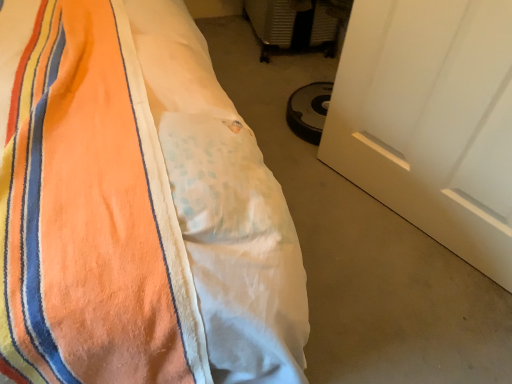
What do you see at coordinates (136, 208) in the screenshot?
I see `orange fleece blanket at left` at bounding box center [136, 208].

Image resolution: width=512 pixels, height=384 pixels. Find the location of `white fabric at lower left`. white fabric at lower left is located at coordinates (362, 248).

The width and height of the screenshot is (512, 384). Describe the element at coordinates (431, 120) in the screenshot. I see `white matte door at lower right` at that location.

At what (x,y) coordinates should I click in order to perform the action: click on orange fleece blanket at left. Please return your answer as a coordinate pair (x, y). This screenshot has width=512, height=384. Looking at the image, I should click on (136, 208).

Looking at this image, is orange fleece blanket at left facing away from white fabric at lower left?

No, orange fleece blanket at left is not facing away from white fabric at lower left.

Image resolution: width=512 pixels, height=384 pixels. I want to click on concrete located on the right of orange fleece blanket at left, so click(x=362, y=248).

Does orange fleece blanket at left come behind white fabric at lower left?

That is False.

How far apart are orange fleece blanket at left and white fabric at lower left?

orange fleece blanket at left is 29.56 inches from white fabric at lower left.

Where is `concrete directly beneath the white matte door at lower right (from a real-world perspective)`? The image size is (512, 384). concrete directly beneath the white matte door at lower right (from a real-world perspective) is located at coordinates (362, 248).

Is white fabric at lower left taller than white matte door at lower right?

No, white fabric at lower left is not taller than white matte door at lower right.

Which is more distant, (402, 267) or (364, 35)?

Point (402, 267)

How far apart are white fabric at lower left and white matte door at lower right?

white fabric at lower left and white matte door at lower right are 11.57 inches apart from each other.

Considering the relative sizes of white matte door at lower right and white fabric at lower left in the image provided, is white matte door at lower right shorter than white fabric at lower left?

No, white matte door at lower right is not shorter than white fabric at lower left.

Locate an element on the screen. door that is below the white fabric at lower left (from the image's perspective) is located at coordinates (431, 120).

Which object is thinner, white matte door at lower right or white fabric at lower left?

Thinner between the two is white matte door at lower right.

Who is bigger, white matte door at lower right or white fabric at lower left?

white matte door at lower right.

In terms of height, does orange fleece blanket at left look taller or shorter compared to white matte door at lower right?

orange fleece blanket at left is taller than white matte door at lower right.

Is orange fleece blanket at left at the right side of white matte door at lower right?

In fact, orange fleece blanket at left is to the left of white matte door at lower right.

Is orange fleece blanket at left wider or thinner than white matte door at lower right?

orange fleece blanket at left is wider than white matte door at lower right.

From a real-world perspective, is orange fleece blanket at left on top of white matte door at lower right?

Yes, from a real-world perspective, orange fleece blanket at left is on top of white matte door at lower right.

Can you confirm if white matte door at lower right is thinner than orange fleece blanket at left?

Yes.

Locate an element on the screen. The image size is (512, 384). bed that is in front of the white matte door at lower right is located at coordinates (136, 208).

Is white matte door at lower right inside or outside of orange fleece blanket at left?

white matte door at lower right is located beyond the bounds of orange fleece blanket at left.

Where is `concrete that is behind the orange fleece blanket at left`? This screenshot has height=384, width=512. concrete that is behind the orange fleece blanket at left is located at coordinates (362, 248).

Can you confirm if white fabric at lower left is wider than orange fleece blanket at left?

Answer: No.

From the image's perspective, which is above, white fabric at lower left or orange fleece blanket at left?

orange fleece blanket at left, from the image's perspective.

Find the location of a particular element. The width and height of the screenshot is (512, 384). bed lying on the left of white fabric at lower left is located at coordinates (136, 208).

Find the location of a particular element. This screenshot has width=512, height=384. door to the right of white fabric at lower left is located at coordinates (431, 120).

Considering their positions, is white fabric at lower left positioned closer to orange fleece blanket at left than white matte door at lower right?

Based on the image, white matte door at lower right appears to be nearer to orange fleece blanket at left.

When comparing their distances from orange fleece blanket at left, does white matte door at lower right or white fabric at lower left seem further?

white fabric at lower left lies further to orange fleece blanket at left than the other object.

Which object lies further to the anchor point white matte door at lower right, orange fleece blanket at left or white fabric at lower left?

orange fleece blanket at left is positioned further to the anchor white matte door at lower right.

Considering their positions, is white fabric at lower left positioned further to white matte door at lower right than orange fleece blanket at left?

Based on the image, orange fleece blanket at left appears to be further to white matte door at lower right.

Which object lies further to the anchor point white fabric at lower left, white matte door at lower right or orange fleece blanket at left?

orange fleece blanket at left is positioned further to the anchor white fabric at lower left.

From the image, which object appears to be farther from white fabric at lower left, orange fleece blanket at left or white matte door at lower right?

Among the two, orange fleece blanket at left is located further to white fabric at lower left.

In order to click on concrete situated between orange fleece blanket at left and white matte door at lower right from left to right in this screenshot , I will do `click(362, 248)`.